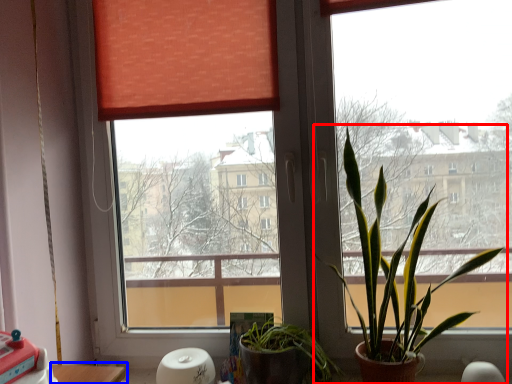
Question: Which point is closer to the camera, houseplant (highlighted by a red box) or table (highlighted by a blue box)?

Choices:
 (A) houseplant
 (B) table

Answer: (A)